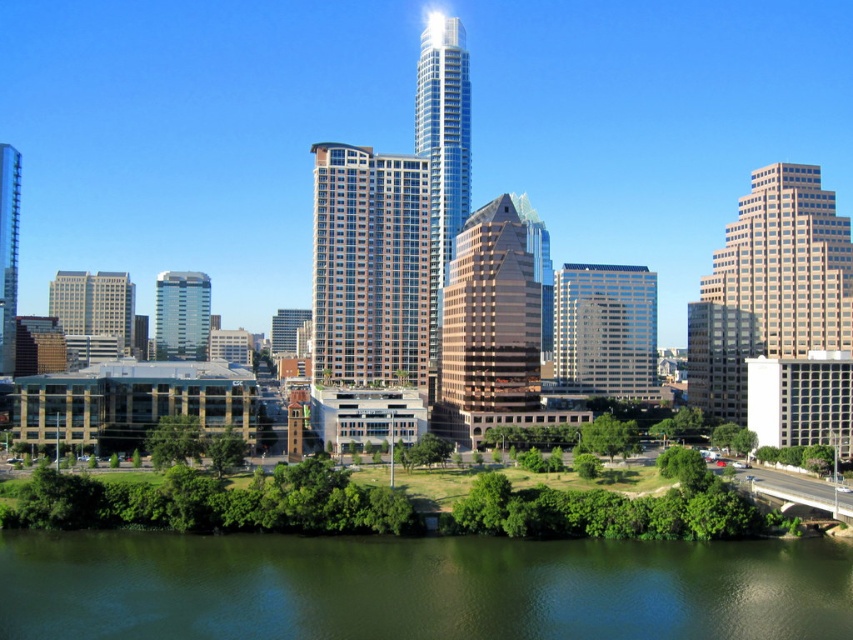
Who is higher up, white glass building at center or gray concrete building at left?

gray concrete building at left is higher up.

Is white glass building at center behind gray concrete building at left?

No, it is not.

Who is more forward, [613,392] or [76,310]?

Point [613,392]

Find the location of a particular element. The image size is (853, 640). white glass building at center is located at coordinates (605, 330).

Who is more distant from viewer, (838, 595) or (194, 285)?

Positioned behind is point (194, 285).

Is green water at lower center in front of matte glass building at center?

That is True.

I want to click on green water at lower center, so click(416, 588).

Looking at this image, can you confirm if glassy brown building at center is shorter than shiny glass skyscraper at center?

Yes.

Is glassy brown building at center in front of shiny glass skyscraper at center?

Yes, glassy brown building at center is closer to the viewer.

Which is behind, point (363, 324) or point (9, 182)?

Point (9, 182)

Image resolution: width=853 pixels, height=640 pixels. I want to click on glassy brown building at center, so click(369, 268).